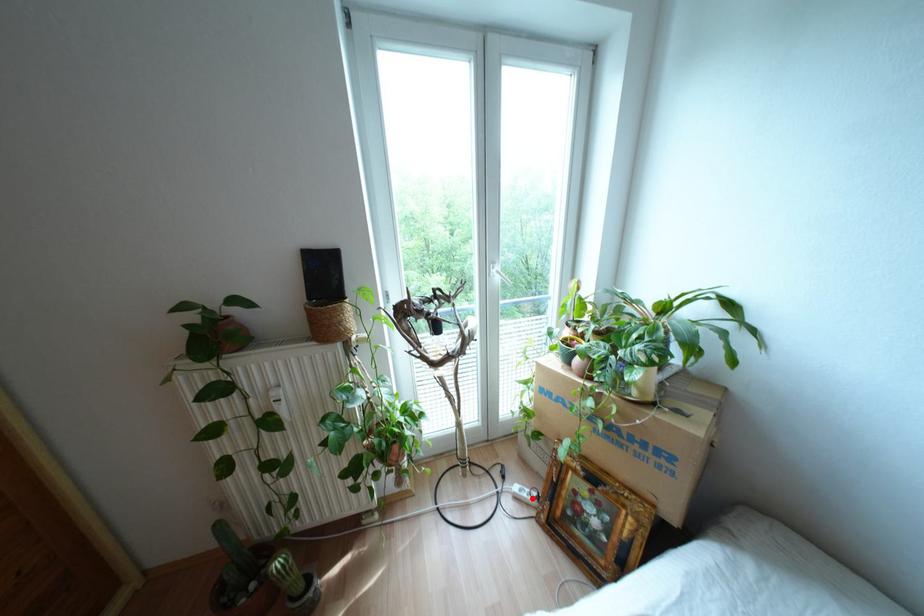
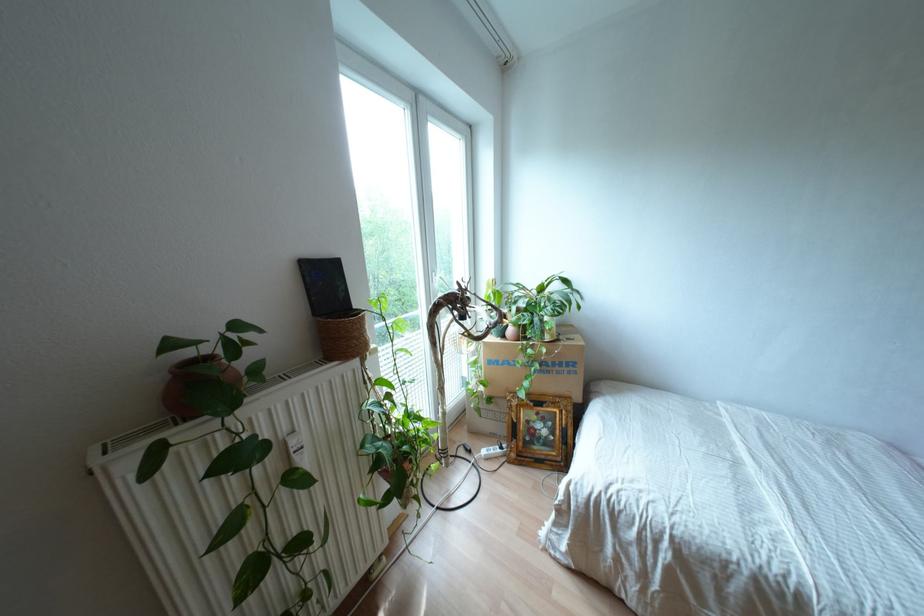
Where in the second image is the point corresponding to the highlighted location from the first image?

(497, 450)